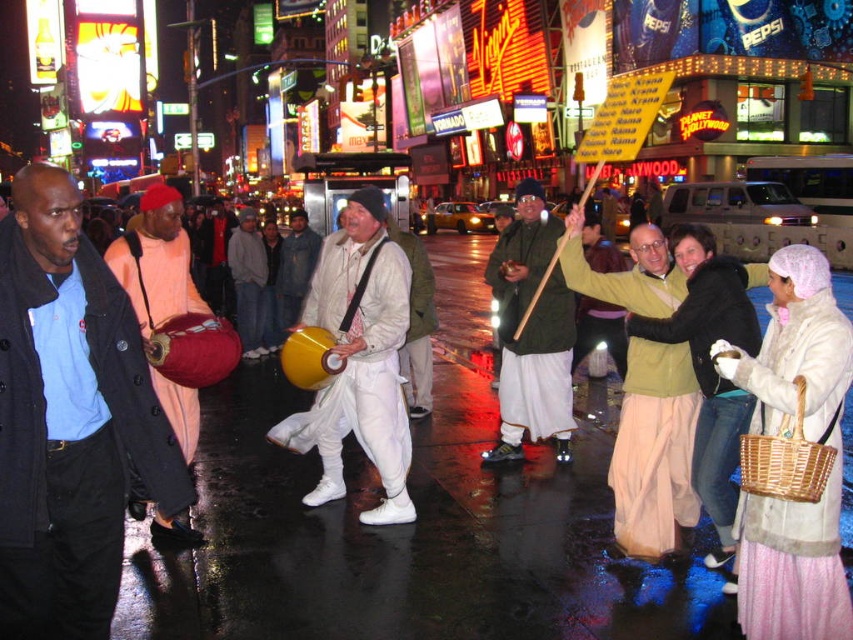
Question: Estimate the real-world distances between objects in this image. Which object is farther from the white cotton pants at center?

Choices:
 (A) matte orange drum at left
 (B) matte yellow drum at center
 (C) matte peach drum at left

Answer: (A)

Question: Which point is farther from the camera taking this photo?

Choices:
 (A) pyautogui.click(x=177, y=228)
 (B) pyautogui.click(x=399, y=477)
 (C) pyautogui.click(x=80, y=570)
 (D) pyautogui.click(x=511, y=292)

Answer: (D)

Question: Which of the following is the closest to the observer?

Choices:
 (A) white cotton pants at center
 (B) matte orange drum at left
 (C) matte peach drum at left

Answer: (B)

Question: Can you confirm if white cotton pants at center is bigger than matte peach drum at left?

Choices:
 (A) no
 (B) yes

Answer: (A)

Question: Is matte orange drum at left behind white cotton pants at center?

Choices:
 (A) no
 (B) yes

Answer: (A)

Question: Where is matte orange drum at left located in relation to white cotton pants at center in the image?

Choices:
 (A) below
 (B) above

Answer: (A)